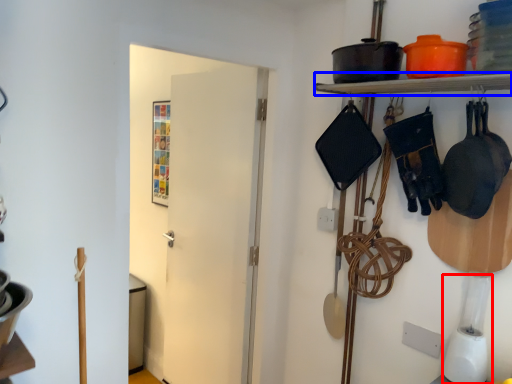
Question: Which object appears closest to the camera in this image, appliance (highlighted by a red box) or shelf (highlighted by a blue box)?

Choices:
 (A) appliance
 (B) shelf

Answer: (B)